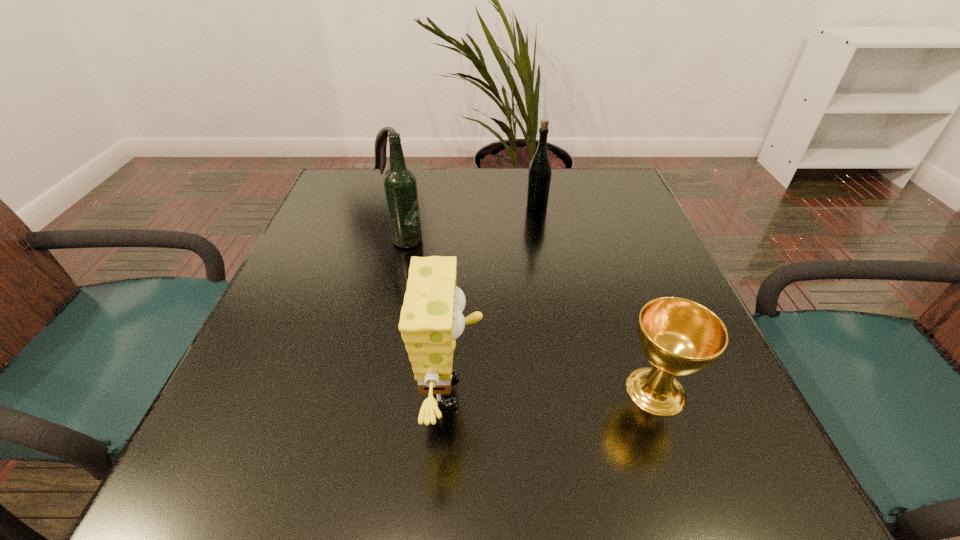
What are the coordinates of `free space that satisfies the following two spatial constraints: 1. on the front side of the rightmost object; 2. on the right side of the tallest object` in the screenshot? It's located at (370, 391).

You are a GUI agent. You are given a task and a screenshot of the screen. Output one action in this format:
    pyautogui.click(x=<x>, y=<y>)
    Task: Click on the free space that satisfies the following two spatial constraints: 1. on the front side of the rightmost object; 2. on the left side of the shorter beer bottle
    
    Given the screenshot: What is the action you would take?
    pyautogui.click(x=569, y=391)

What are the coordinates of `vacant space that satisfies the following two spatial constraints: 1. on the back side of the second object from right to left; 2. on the right side of the leftmost object` in the screenshot? It's located at (410, 207).